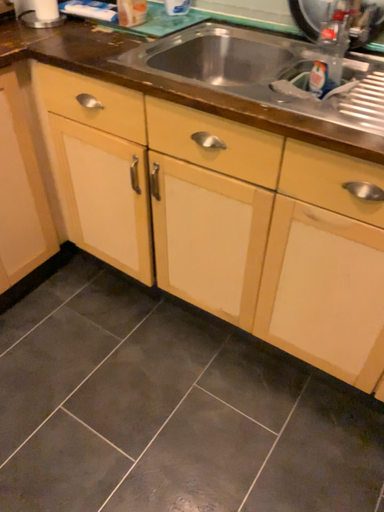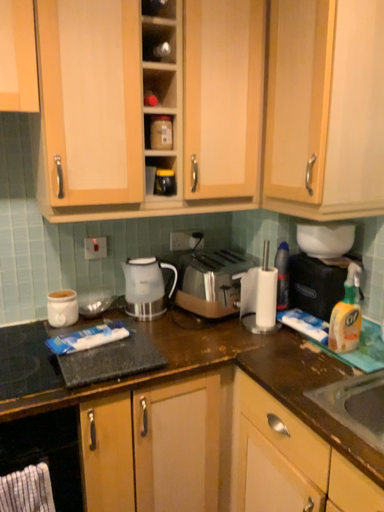
Question: How did the camera likely rotate when shooting the video?

Choices:
 (A) rotated right
 (B) rotated left

Answer: (B)